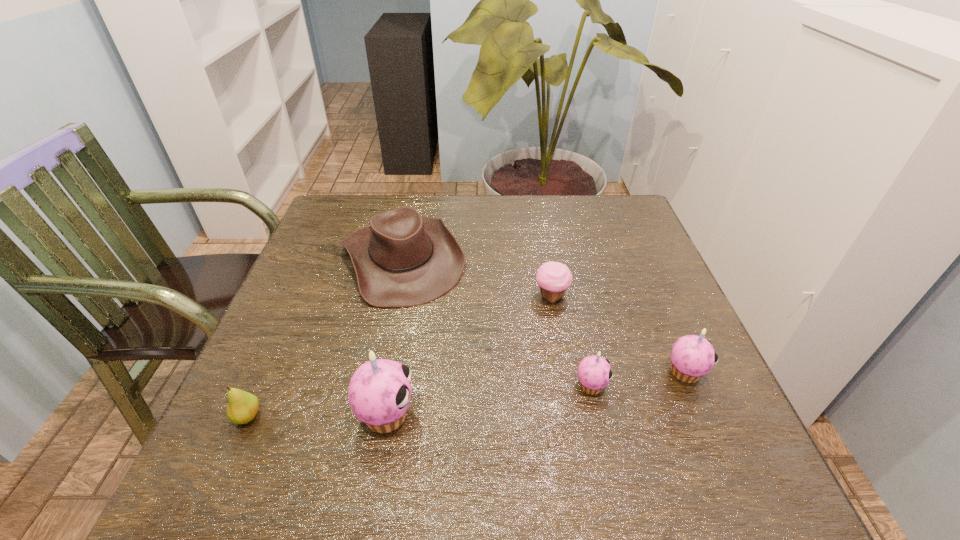
Where is `vacant space at the left edge`? The image size is (960, 540). vacant space at the left edge is located at coordinates click(x=298, y=360).

What are the coordinates of `vacant area at the right edge` in the screenshot? It's located at (647, 316).

In the image, there is a desktop. Identify the location of vacant space at the far left corner. (382, 206).

Where is `free space at the far right corner of the desktop`? The image size is (960, 540). free space at the far right corner of the desktop is located at coordinates point(627,227).

Locate an element on the screen. The width and height of the screenshot is (960, 540). blank region between the rightmost object and the cowboy hat is located at coordinates (543, 315).

The image size is (960, 540). What are the coordinates of `empty location between the tallest cupcake and the second tallest cupcake` in the screenshot? It's located at (536, 393).

Identify the location of blank region between the tallest object and the farthest cupcake. This screenshot has height=540, width=960. (468, 355).

Where is `free space between the cowboy hat and the pear`? The height and width of the screenshot is (540, 960). free space between the cowboy hat and the pear is located at coordinates (324, 338).

The height and width of the screenshot is (540, 960). In order to click on free space between the cowboy hat and the rightmost object in this screenshot , I will do `click(543, 315)`.

Point out which object is positioned as the fifth nearest to the third shortest cupcake. Please provide its 2D coordinates. Your answer should be formatted as a tuple, i.e. [(x, y)], where the tuple contains the x and y coordinates of a point satisfying the conditions above.

[(243, 406)]